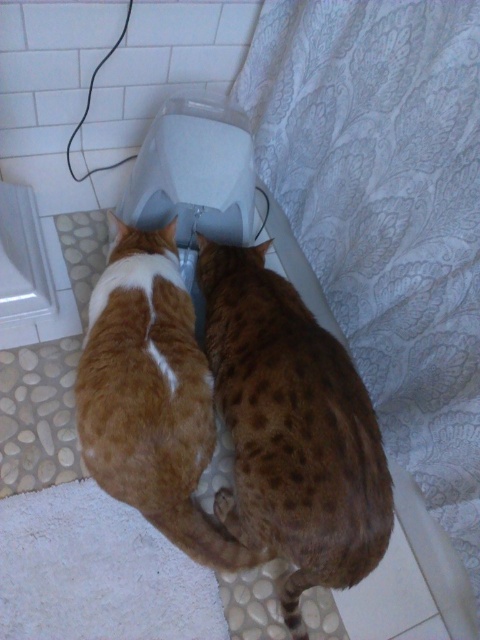
You are a pet owner trying to fit both cats into a carrier that can only accommodate a total width of 40 cm. Given that the spotted fur cat at center is wider than the orange fur cat at center, what should you do?

The spotted fur cat at center is wider than the orange fur cat at center. Since the carrier can only hold 40 cm total width, you should measure both cats individually to ensure their combined width doesn not exceed the limit.

You are a pet owner who wants to place a new toy between the spotted fur cat at center and the orange fur cat at center. Based on their positions, which cat will be closer to the toy when placed in the middle?

The orange fur cat at center will be closer to the toy because the spotted fur cat at center is positioned on the right side of it, meaning the orange fur cat is on the left. Placing the toy in the middle between them would make the orange fur cat closer to the toy.

You are a cat owner who wants to place a small bowl between the spotted fur cat at center and the orange fur cat at center. The bowl has a diameter of 5 inches. Will the bowl fit between them without overlapping either cat?

The spotted fur cat at center and orange fur cat at center are 5.50 inches apart. Since the bowl has a diameter of 5 inches, which is less than the 5.50 inches space between them, the bowl will fit between them without overlapping either cat.